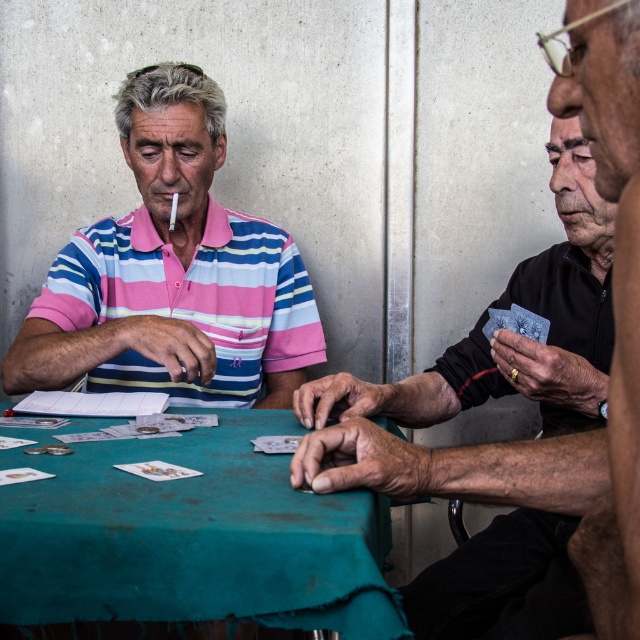
Question: Which object is positioned farthest from the green fabric table at center?

Choices:
 (A) matte black shirt at right
 (B) black matte card at right
 (C) matte striped polo shirt at left

Answer: (B)

Question: Can you confirm if matte black shirt at right is wider than matte striped polo shirt at left?

Choices:
 (A) yes
 (B) no

Answer: (B)

Question: Which point is farther to the camera?

Choices:
 (A) matte black shirt at right
 (B) black matte card at right
 (C) matte striped polo shirt at left

Answer: (C)

Question: Observing the image, what is the correct spatial positioning of green fabric table at center in reference to matte striped polo shirt at left?

Choices:
 (A) right
 (B) left

Answer: (A)

Question: Which point is farther from the camera taking this photo?

Choices:
 (A) (621, 563)
 (B) (371, 432)

Answer: (B)

Question: Does green fabric table at center have a greater width compared to matte striped polo shirt at left?

Choices:
 (A) yes
 (B) no

Answer: (A)